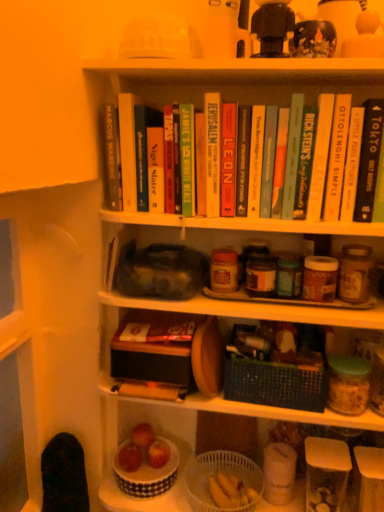
Question: Is hardcover book at center, which appears as the sixth paperback book when viewed from the left, thinner than hardcover book at upper center, the seventh paperback book viewed from the left?

Choices:
 (A) yes
 (B) no

Answer: (B)

Question: Does hardcover book at center, which appears as the sixth paperback book when viewed from the left, turn towards hardcover book at upper center, the 7th paperback book from the right?

Choices:
 (A) yes
 (B) no

Answer: (B)

Question: From the image's perspective, is hardcover book at center, the 8th paperback book viewed from the right, below hardcover book at upper center, the 7th paperback book from the right?

Choices:
 (A) no
 (B) yes

Answer: (A)

Question: Are hardcover book at center, which appears as the sixth paperback book when viewed from the left, and hardcover book at upper center, the 7th paperback book from the right, located far from each other?

Choices:
 (A) no
 (B) yes

Answer: (A)

Question: Does hardcover book at center, the 8th paperback book viewed from the right, have a greater height compared to hardcover book at upper center, the seventh paperback book viewed from the left?

Choices:
 (A) yes
 (B) no

Answer: (A)

Question: From the image's perspective, is white textured bowl at lower center positioned above or below hardcover book at upper center, the 7th paperback book from the right?

Choices:
 (A) above
 (B) below

Answer: (B)

Question: In terms of width, does white textured bowl at lower center look wider or thinner when compared to hardcover book at upper center, the 7th paperback book from the right?

Choices:
 (A) thin
 (B) wide

Answer: (B)

Question: Based on their positions, is white textured bowl at lower center located to the left or right of hardcover book at upper center, the seventh paperback book viewed from the left?

Choices:
 (A) left
 (B) right

Answer: (A)

Question: Is white textured bowl at lower center inside the boundaries of hardcover book at upper center, the seventh paperback book viewed from the left, or outside?

Choices:
 (A) outside
 (B) inside

Answer: (A)

Question: Choose the correct answer: Is wooden basket at center, acting as the 2th shelf starting from the bottom, inside hardcover book at upper center, positioned as the 2th paperback book in left-to-right order, or outside it?

Choices:
 (A) inside
 (B) outside

Answer: (B)

Question: Does point (241, 309) appear closer or farther from the camera than point (119, 125)?

Choices:
 (A) farther
 (B) closer

Answer: (A)

Question: In terms of width, does wooden basket at center, acting as the 2th shelf starting from the bottom, look wider or thinner when compared to hardcover book at upper center, positioned as the 2th paperback book in left-to-right order?

Choices:
 (A) thin
 (B) wide

Answer: (B)

Question: From a real-world perspective, is wooden basket at center, acting as the 2th shelf starting from the bottom, positioned above or below hardcover book at upper center, the 12th paperback book from the right?

Choices:
 (A) above
 (B) below

Answer: (B)

Question: From a real-world perspective, is hardcover book at upper center, marked as the ninth paperback book in a left-to-right arrangement, positioned above or below hardcover book at upper center, the 7th paperback book from the right?

Choices:
 (A) below
 (B) above

Answer: (B)

Question: Considering their positions, is hardcover book at upper center, marked as the ninth paperback book in a left-to-right arrangement, located in front of or behind hardcover book at upper center, the 7th paperback book from the right?

Choices:
 (A) front
 (B) behind

Answer: (A)